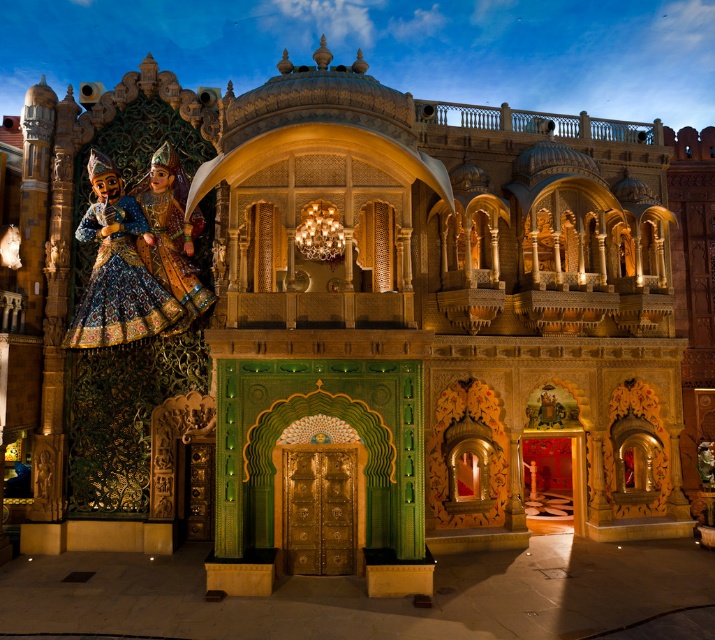
Is blue embroidered fabric at left thinner than shiny gold dress at left?

Indeed, blue embroidered fabric at left has a lesser width compared to shiny gold dress at left.

Is blue embroidered fabric at left to the left of shiny gold dress at left from the viewer's perspective?

Correct, you'll find blue embroidered fabric at left to the left of shiny gold dress at left.

Between point (89, 308) and point (179, 323), which one is positioned behind?

Point (179, 323)

This screenshot has height=640, width=715. Find the location of `blue embroidered fabric at left`. blue embroidered fabric at left is located at coordinates (117, 269).